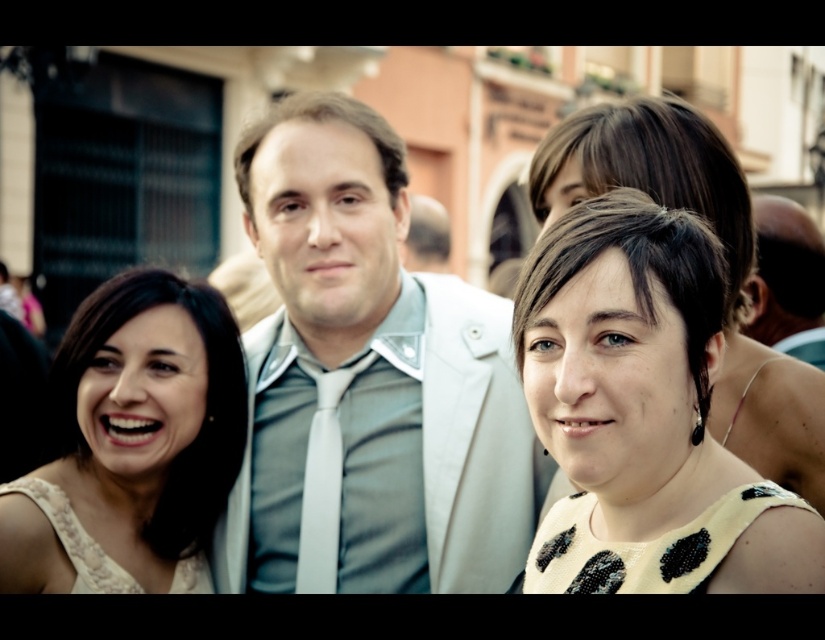
Looking at this image, which of these two, yellow dotted dress at center or white silk tie at center, stands taller?

yellow dotted dress at center

Between yellow dotted dress at center and white silk tie at center, which one appears on the right side from the viewer's perspective?

From the viewer's perspective, yellow dotted dress at center appears more on the right side.

Who is more forward, [642,260] or [314,548]?

Point [642,260] is in front.

At what (x,y) coordinates should I click in order to perform the action: click on yellow dotted dress at center. Please return your answer as a coordinate pair (x, y). Looking at the image, I should click on (644, 416).

Is light gray fabric suit at center shorter than yellow dotted dress at center?

No, light gray fabric suit at center is not shorter than yellow dotted dress at center.

Is point (408, 294) in front of point (732, 552)?

That is False.

Where is `light gray fabric suit at center`? The image size is (825, 640). light gray fabric suit at center is located at coordinates (368, 384).

Can you confirm if matte beige dress at center is bigger than matte white suit at center?

No, matte beige dress at center is not bigger than matte white suit at center.

At what (x,y) coordinates should I click in order to perform the action: click on matte beige dress at center. Please return your answer as a coordinate pair (x, y). The height and width of the screenshot is (640, 825). Looking at the image, I should click on (132, 444).